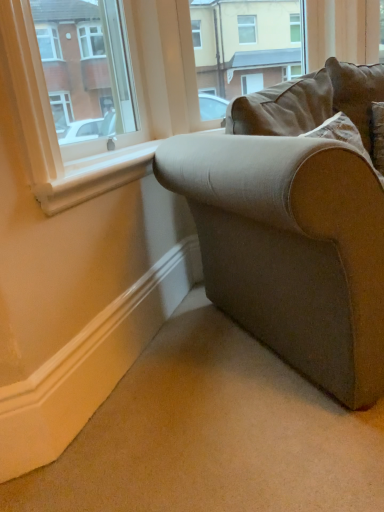
Question: Is the depth of brown fabric couch at upper right less than that of textured beige couch at lower right?

Choices:
 (A) yes
 (B) no

Answer: (B)

Question: Can you confirm if brown fabric couch at upper right is positioned to the right of textured beige couch at lower right?

Choices:
 (A) no
 (B) yes

Answer: (A)

Question: From a real-world perspective, is brown fabric couch at upper right under textured beige couch at lower right?

Choices:
 (A) yes
 (B) no

Answer: (B)

Question: Does brown fabric couch at upper right have a lesser height compared to textured beige couch at lower right?

Choices:
 (A) yes
 (B) no

Answer: (A)

Question: Is brown fabric couch at upper right outside textured beige couch at lower right?

Choices:
 (A) yes
 (B) no

Answer: (A)

Question: From a real-world perspective, is brown fabric couch at upper right positioned over textured beige couch at lower right based on gravity?

Choices:
 (A) yes
 (B) no

Answer: (A)

Question: From the image's perspective, is brown fabric couch at upper right on top of matte white window at upper left?

Choices:
 (A) no
 (B) yes

Answer: (B)

Question: Is brown fabric couch at upper right surrounding matte white window at upper left?

Choices:
 (A) yes
 (B) no

Answer: (B)

Question: Considering the relative positions of brown fabric couch at upper right and matte white window at upper left in the image provided, is brown fabric couch at upper right to the left of matte white window at upper left from the viewer's perspective?

Choices:
 (A) no
 (B) yes

Answer: (A)

Question: From the image's perspective, is brown fabric couch at upper right below matte white window at upper left?

Choices:
 (A) yes
 (B) no

Answer: (B)

Question: Is brown fabric couch at upper right shorter than matte white window at upper left?

Choices:
 (A) no
 (B) yes

Answer: (A)

Question: Is matte white window at upper left at the back of brown fabric couch at upper right?

Choices:
 (A) no
 (B) yes

Answer: (A)

Question: From the image's perspective, is matte white window at upper left over brown fabric couch at upper right?

Choices:
 (A) no
 (B) yes

Answer: (A)